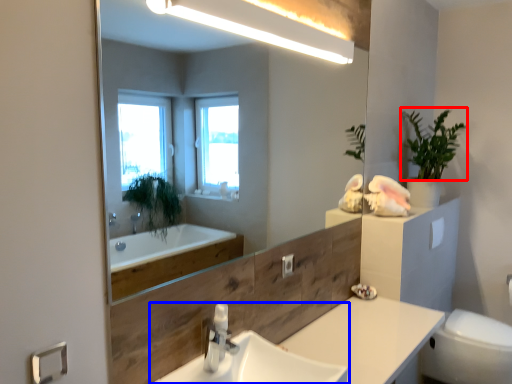
Question: Which object appears farthest to the camera in this image, plant (highlighted by a red box) or sink (highlighted by a blue box)?

Choices:
 (A) plant
 (B) sink

Answer: (A)